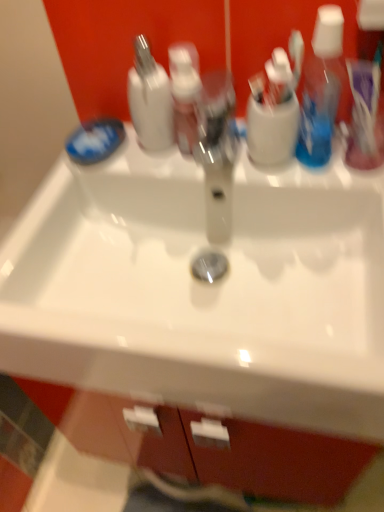
Question: Is blue matte soap at left looking in the opposite direction of translucent pink pump bottle at center?

Choices:
 (A) no
 (B) yes

Answer: (A)

Question: Considering the relative sizes of blue matte soap at left and translucent pink pump bottle at center in the image provided, is blue matte soap at left shorter than translucent pink pump bottle at center?

Choices:
 (A) yes
 (B) no

Answer: (A)

Question: Can you confirm if blue matte soap at left is thinner than translucent pink pump bottle at center?

Choices:
 (A) no
 (B) yes

Answer: (A)

Question: From a real-world perspective, is blue matte soap at left beneath translucent pink pump bottle at center?

Choices:
 (A) no
 (B) yes

Answer: (B)

Question: Is blue matte soap at left not inside translucent pink pump bottle at center?

Choices:
 (A) no
 (B) yes

Answer: (B)

Question: Based on their positions, is translucent pink pump bottle at center located to the left or right of white glossy bottle at upper center?

Choices:
 (A) right
 (B) left

Answer: (A)

Question: Is translucent pink pump bottle at center taller or shorter than white glossy bottle at upper center?

Choices:
 (A) tall
 (B) short

Answer: (B)

Question: In terms of width, does translucent pink pump bottle at center look wider or thinner when compared to white glossy bottle at upper center?

Choices:
 (A) thin
 (B) wide

Answer: (A)

Question: From a real-world perspective, relative to white glossy bottle at upper center, is translucent pink pump bottle at center vertically above or below?

Choices:
 (A) below
 (B) above

Answer: (A)

Question: From a real-world perspective, is white glossy bottle at upper center positioned above or below blue matte soap at left?

Choices:
 (A) below
 (B) above

Answer: (B)

Question: Is white glossy bottle at upper center in front of or behind blue matte soap at left in the image?

Choices:
 (A) behind
 (B) front

Answer: (B)

Question: From the image's perspective, relative to blue matte soap at left, is white glossy bottle at upper center above or below?

Choices:
 (A) above
 (B) below

Answer: (A)

Question: Is white glossy bottle at upper center inside the boundaries of blue matte soap at left, or outside?

Choices:
 (A) outside
 (B) inside

Answer: (A)

Question: Is translucent plastic toothbrush at upper right taller or shorter than white glossy sink at center?

Choices:
 (A) tall
 (B) short

Answer: (B)

Question: Which is correct: translucent plastic toothbrush at upper right is inside white glossy sink at center, or outside of it?

Choices:
 (A) inside
 (B) outside

Answer: (B)